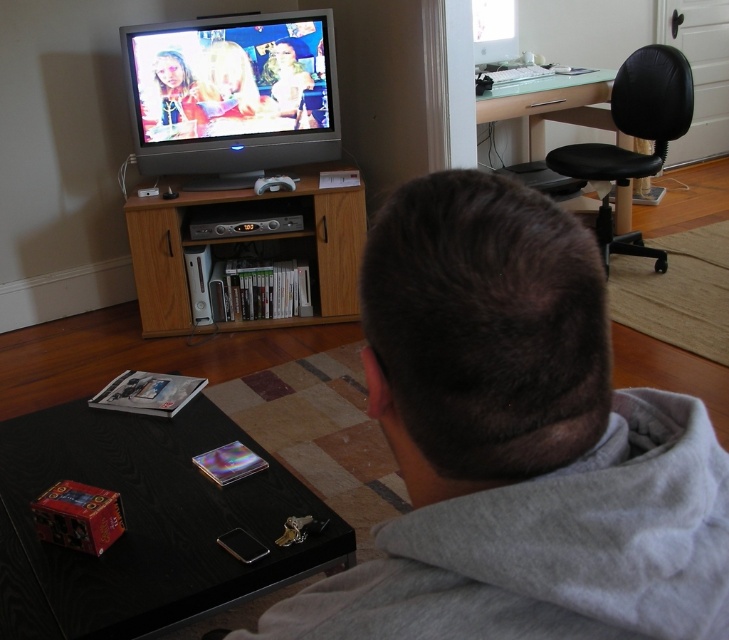
You are trying to decide whether to place a tall plant on the wooden entertainment center at center or the black leather swivel chair at upper right. Based on their heights, which surface would be more stable for the plant?

The wooden entertainment center at center has a lesser height compared to the black leather swivel chair at upper right. Since the entertainment center is shorter, placing the tall plant there would provide a more stable base as it would be lower to the ground, reducing the risk of tipping over.

You are standing in the living room and want to hand a gift to the person wearing the gray cotton hoodie at upper center without moving the wooden entertainment center at center. How can you ensure the gift reaches them safely?

Since the gray cotton hoodie at upper center is closer to the viewer than the wooden entertainment center at center, you can directly hand the gift to the person by placing it on the coffee table near them, ensuring it is within their reach without needing to move the entertainment center.